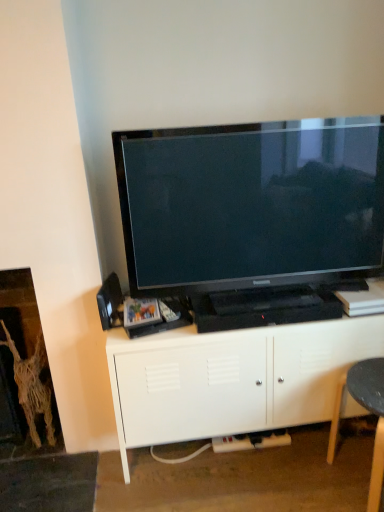
Question: From a real-world perspective, is matte black tv at center positioned above or below black plastic plug at lower center?

Choices:
 (A) above
 (B) below

Answer: (A)

Question: Does point (228, 140) appear closer or farther from the camera than point (284, 435)?

Choices:
 (A) farther
 (B) closer

Answer: (B)

Question: Which object is positioned farthest from the brown woven fireplace at left?

Choices:
 (A) black plastic plug at lower center
 (B) matte black tv at center
 (C) black plastic swivel chair at lower right
 (D) white matte cabinet at center

Answer: (C)

Question: Estimate the real-world distances between objects in this image. Which object is farther from the black plastic plug at lower center?

Choices:
 (A) black plastic swivel chair at lower right
 (B) brown woven fireplace at left
 (C) white matte cabinet at center
 (D) matte black tv at center

Answer: (D)